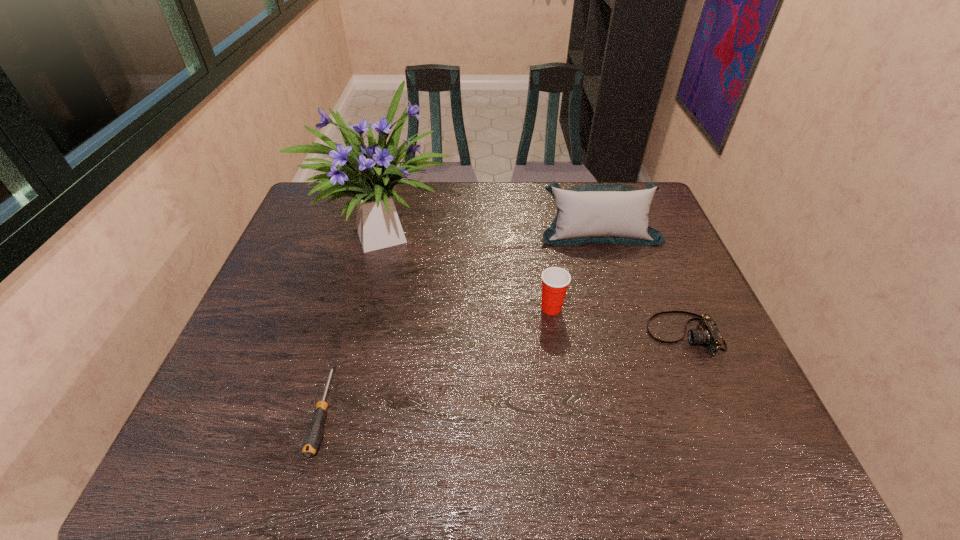
Where is `the tallest object`? The width and height of the screenshot is (960, 540). the tallest object is located at coordinates (369, 174).

Image resolution: width=960 pixels, height=540 pixels. Identify the location of the second tallest object. (591, 213).

The width and height of the screenshot is (960, 540). Find the location of `Dixie cup`. Dixie cup is located at coordinates (555, 280).

This screenshot has height=540, width=960. What are the coordinates of `camera` in the screenshot? It's located at (707, 333).

Find the location of a particular element. This screenshot has height=540, width=960. the nearest object is located at coordinates (313, 435).

This screenshot has height=540, width=960. I want to click on screwdriver, so click(x=313, y=435).

This screenshot has width=960, height=540. I want to click on free space located on the front of the tallest object, so click(357, 357).

Identify the location of free space located 0.360m on the surface of the fourth shortest object. The height and width of the screenshot is (540, 960). (633, 343).

This screenshot has height=540, width=960. Find the location of `vacant space located 0.160m on the right of the Dixie cup`. vacant space located 0.160m on the right of the Dixie cup is located at coordinates (627, 308).

I want to click on vacant space located on the front-facing side of the camera, so click(x=542, y=334).